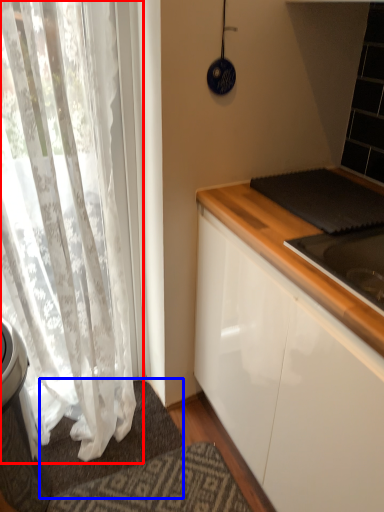
Question: Among these objects, which one is farthest to the camera, curtain (highlighted by a red box) or doormat (highlighted by a blue box)?

Choices:
 (A) curtain
 (B) doormat

Answer: (B)